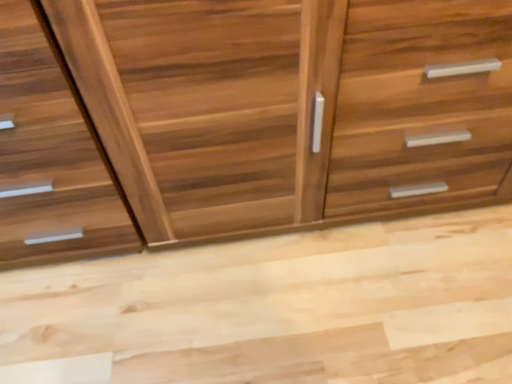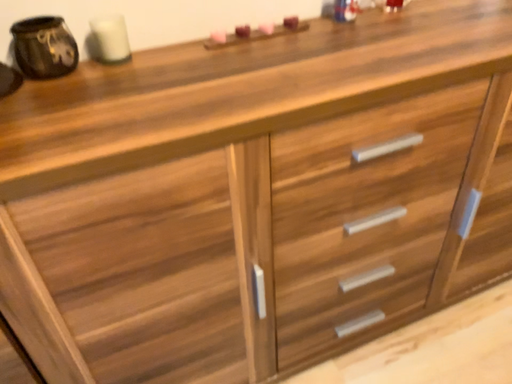
Question: Which way did the camera rotate in the video?

Choices:
 (A) rotated downward
 (B) rotated upward

Answer: (B)